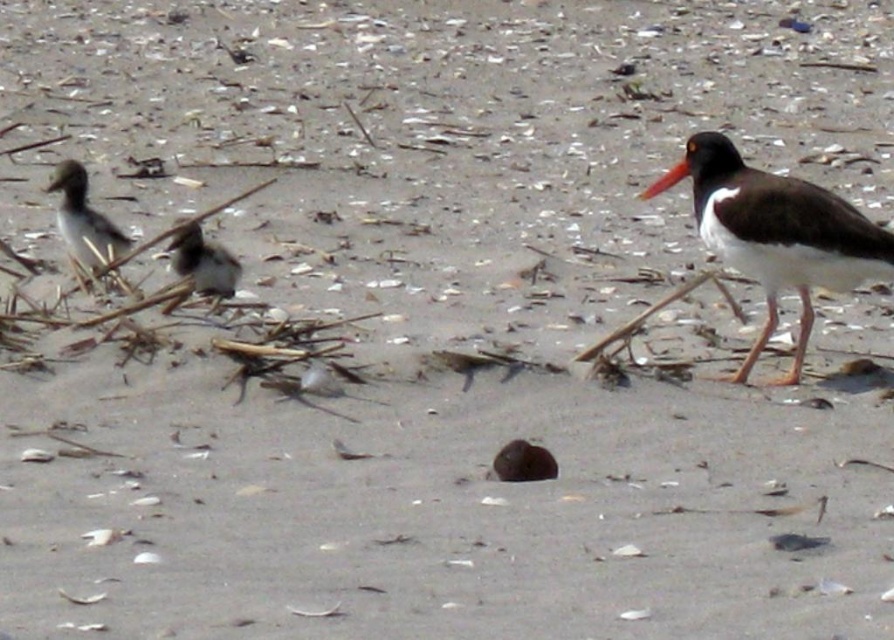
Looking at this image, does brown feathered bird at right appear over brown speckled feathers at center?

Actually, brown feathered bird at right is below brown speckled feathers at center.

Which is below, brown feathered bird at right or brown speckled feathers at center?

brown feathered bird at right

Between point (751, 358) and point (218, 289), which one is positioned behind?

Positioned behind is point (218, 289).

I want to click on brown feathered bird at right, so click(x=780, y=236).

Is brown speckled feathers at center below orange beak at right?

Indeed, brown speckled feathers at center is positioned under orange beak at right.

What do you see at coordinates (201, 260) in the screenshot? The image size is (894, 640). I see `brown speckled feathers at center` at bounding box center [201, 260].

Identify the location of brown speckled feathers at center. The width and height of the screenshot is (894, 640). (201, 260).

Is brown feathered bird at right further to the viewer compared to orange beak at right?

No, brown feathered bird at right is closer to the viewer.

Who is shorter, brown feathered bird at right or orange beak at right?

orange beak at right is shorter.

The height and width of the screenshot is (640, 894). I want to click on brown feathered bird at right, so click(x=780, y=236).